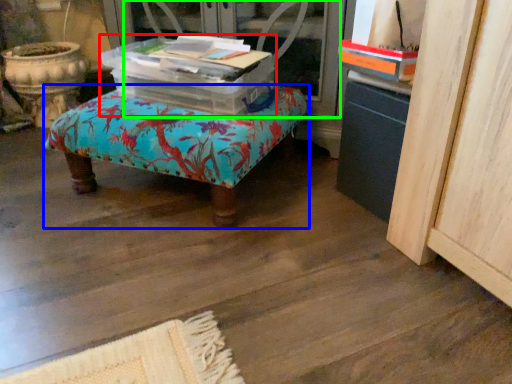
Question: Which is farther away from storage box (highlighted by a red box)? furniture (highlighted by a blue box) or screen door (highlighted by a green box)?

Choices:
 (A) furniture
 (B) screen door

Answer: (B)